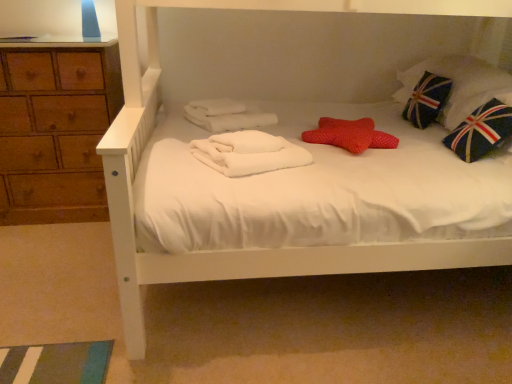
Question: Relative to blue fabric pillow with union jack design at right, is union jack fabric pillow at upper right, the first pillow from the back, in front or behind?

Choices:
 (A) behind
 (B) front

Answer: (A)

Question: Is union jack fabric pillow at upper right, acting as the 2th pillow starting from the front, wider or thinner than blue fabric pillow with union jack design at right?

Choices:
 (A) thin
 (B) wide

Answer: (B)

Question: Estimate the real-world distances between objects in this image. Which object is closer to the union jack fabric pillow at upper right, which is counted as the second pillow, starting from the left?

Choices:
 (A) white soft towel at center
 (B) red dotted pillow at center, which is counted as the 1th pillow, starting from the front
 (C) blue fabric pillow with union jack design at right

Answer: (C)

Question: Which is farther from the blue fabric pillow with union jack design at right?

Choices:
 (A) red dotted pillow at center, arranged as the first pillow when ordered from the bottom
 (B) union jack fabric pillow at upper right, the first pillow from the back
 (C) white soft towel at center

Answer: (C)